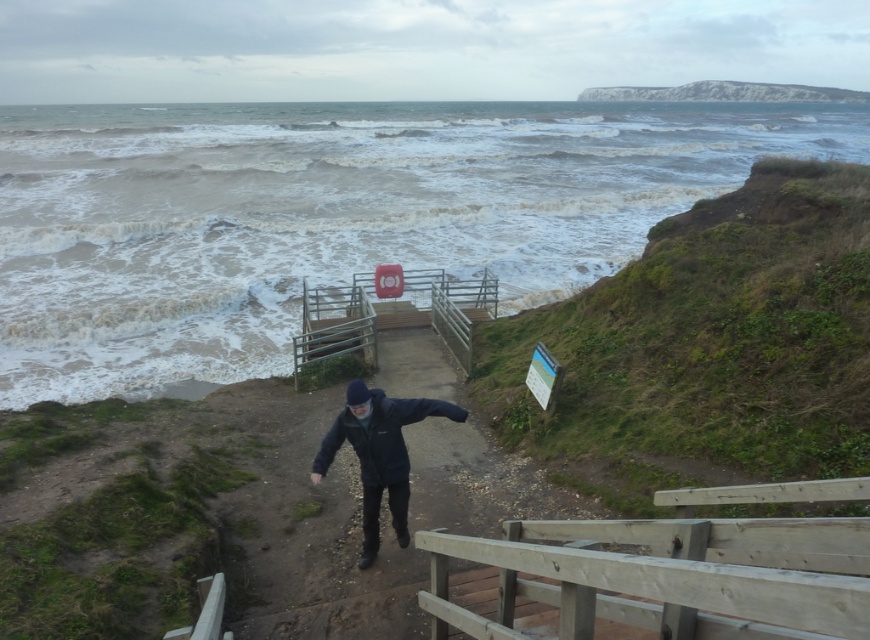
Question: Among these objects, which one is nearest to the camera?

Choices:
 (A) wooden balustrade at lower right
 (B) dark blue jacket at center
 (C) wooden at center
 (D) green grassy cliff at right

Answer: (A)

Question: Which of the following is the farthest from the observer?

Choices:
 (A) white rocky cliff at upper right
 (B) dark blue jacket at center
 (C) wooden balustrade at lower right
 (D) green grassy cliff at right

Answer: (A)

Question: Which point is farther to the camera?

Choices:
 (A) (370, 342)
 (B) (840, 92)
 (C) (328, 436)

Answer: (B)

Question: Is wooden at center below dark blue jacket at center?

Choices:
 (A) yes
 (B) no

Answer: (B)

Question: Can you confirm if wooden at center is positioned to the right of white rocky cliff at upper right?

Choices:
 (A) yes
 (B) no

Answer: (B)

Question: Is wooden balustrade at lower right positioned at the back of dark blue jacket at center?

Choices:
 (A) no
 (B) yes

Answer: (A)